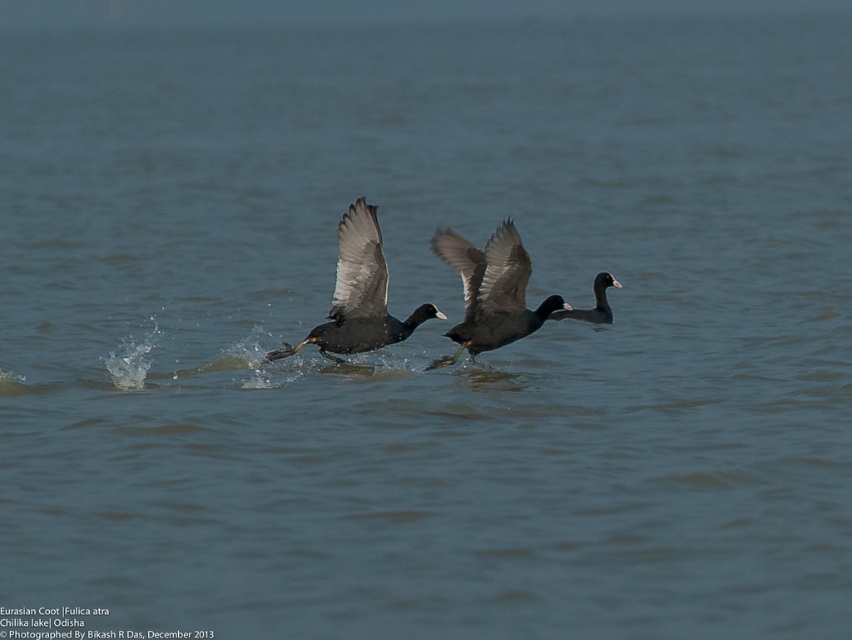
Question: Can you confirm if dark gray matte eurasian coot at center is positioned to the right of dark gray feathers at center?

Choices:
 (A) yes
 (B) no

Answer: (A)

Question: Is dark gray feathers at center further to the viewer compared to black glossy eurasian coot at center?

Choices:
 (A) no
 (B) yes

Answer: (A)

Question: Which of the following is the closest to the observer?

Choices:
 (A) dark gray feathers at center
 (B) dark gray matte eurasian coot at center
 (C) black glossy eurasian coot at center

Answer: (B)

Question: Which object appears closest to the camera in this image?

Choices:
 (A) dark gray matte eurasian coot at center
 (B) dark gray feathers at center

Answer: (A)

Question: Is dark gray matte eurasian coot at center to the left of black glossy eurasian coot at center from the viewer's perspective?

Choices:
 (A) no
 (B) yes

Answer: (B)

Question: Which of these objects is positioned farthest from the dark gray feathers at center?

Choices:
 (A) dark gray matte eurasian coot at center
 (B) black glossy eurasian coot at center

Answer: (B)